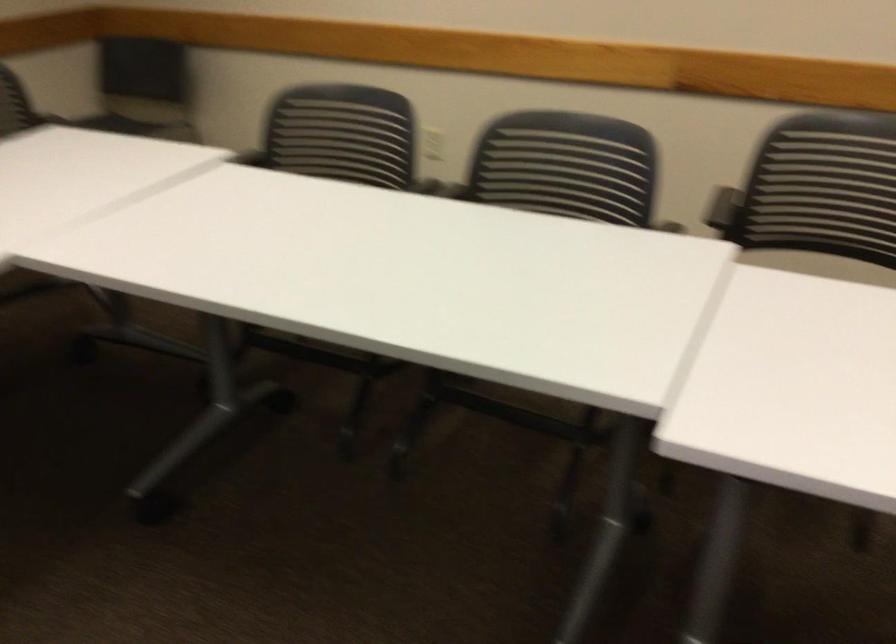
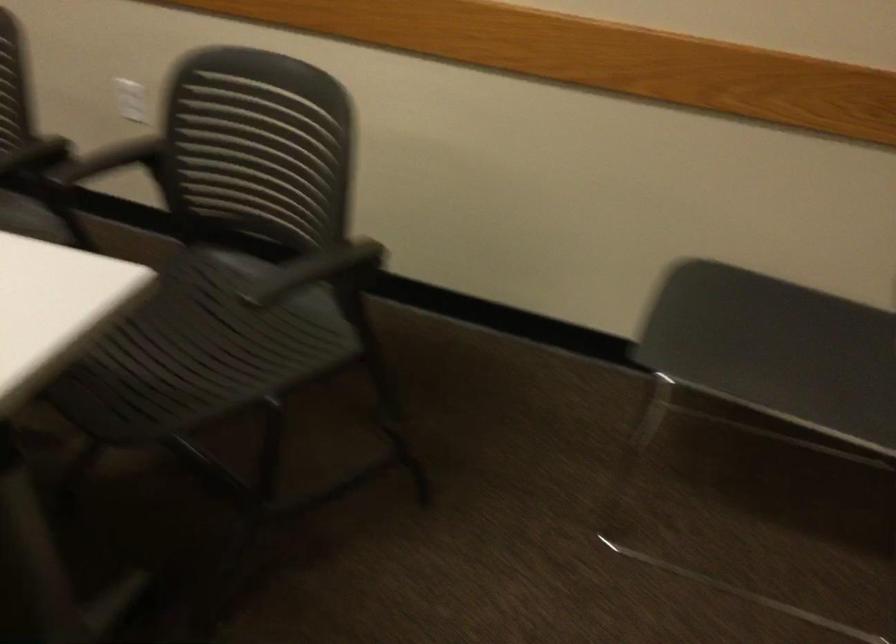
The point at (112, 127) is marked in the first image. Where is the corresponding point in the second image?

(714, 323)